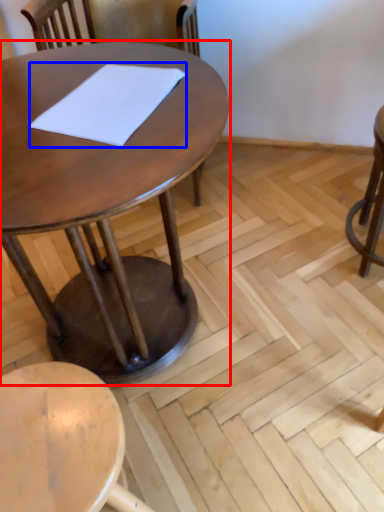
Question: Which object is further to the camera taking this photo, table (highlighted by a red box) or notepad (highlighted by a blue box)?

Choices:
 (A) table
 (B) notepad

Answer: (B)